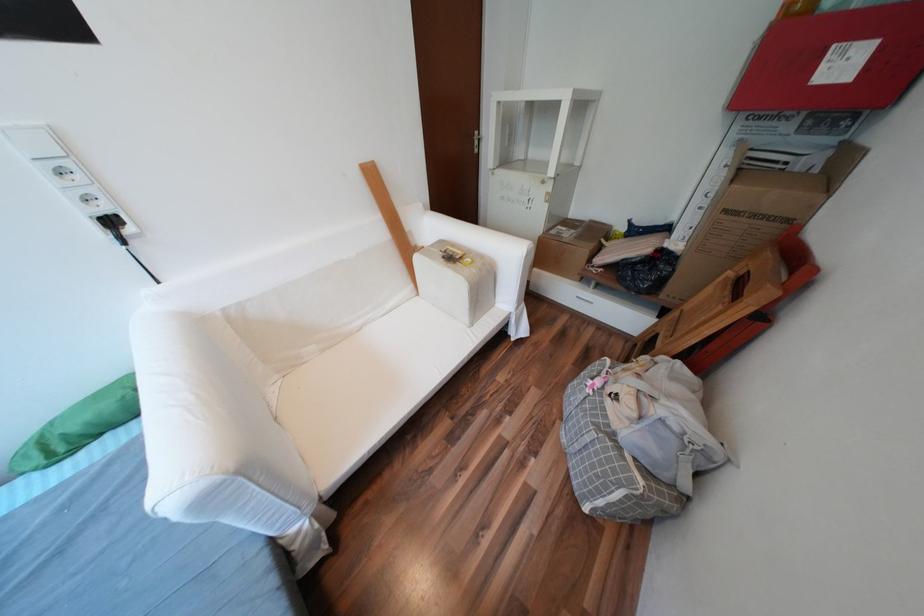
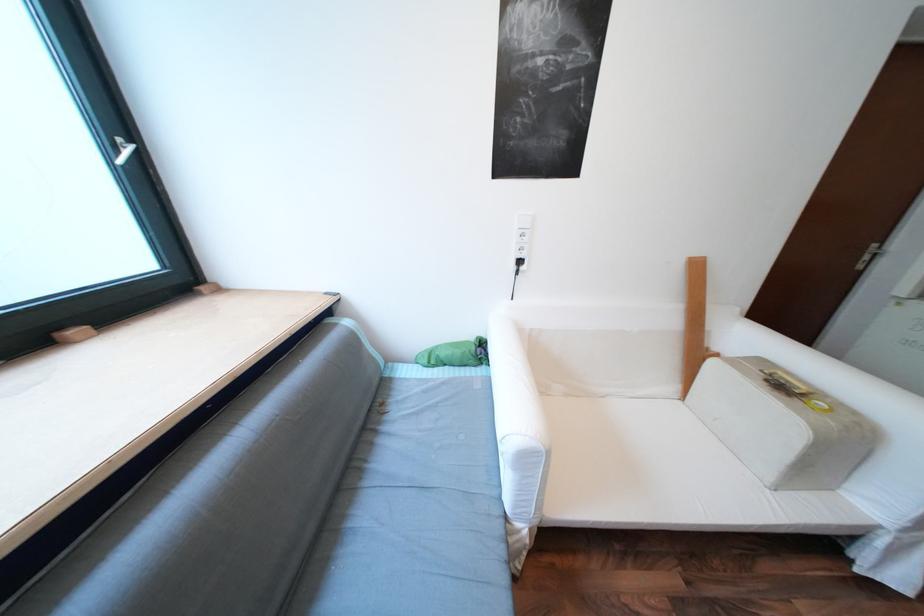
Question: The camera is either moving clockwise (left) or counter-clockwise (right) around the object. The first image is from the beginning of the video and the second image is from the end. Is the camera moving left or right when shooting the video?

Choices:
 (A) Left
 (B) Right

Answer: (B)